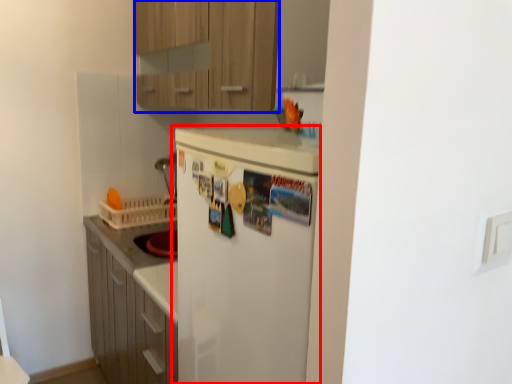
Question: Which object appears farthest to the camera in this image, refrigerator (highlighted by a red box) or cabinetry (highlighted by a blue box)?

Choices:
 (A) refrigerator
 (B) cabinetry

Answer: (B)